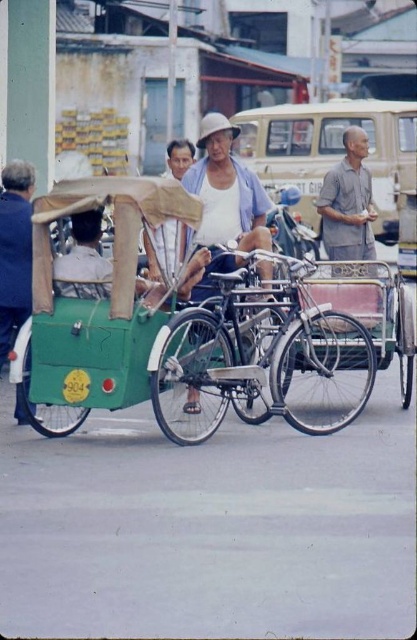
Is white cotton hat at center bigger than green fabric cart at left?

Correct, white cotton hat at center is larger in size than green fabric cart at left.

Between white cotton hat at center and green fabric cart at left, which one appears on the right side from the viewer's perspective?

Positioned to the right is white cotton hat at center.

Does point (263, 225) come in front of point (85, 252)?

No, (263, 225) is behind (85, 252).

Locate an element on the screen. The width and height of the screenshot is (417, 640). white cotton hat at center is located at coordinates (226, 189).

Is white cotton hat at center below blue fabric shirt at left?

Incorrect, white cotton hat at center is not positioned below blue fabric shirt at left.

Between white cotton hat at center and blue fabric shirt at left, which one appears on the right side from the viewer's perspective?

white cotton hat at center is more to the right.

Where is `white cotton hat at center`? This screenshot has height=640, width=417. white cotton hat at center is located at coordinates (226, 189).

Which is below, green matte tricycle at center or silver metallic bicycle at center?

green matte tricycle at center

Which is in front, point (34, 284) or point (223, 324)?

Point (34, 284) is more forward.

Find the location of a particular element. The width and height of the screenshot is (417, 640). green matte tricycle at center is located at coordinates (203, 326).